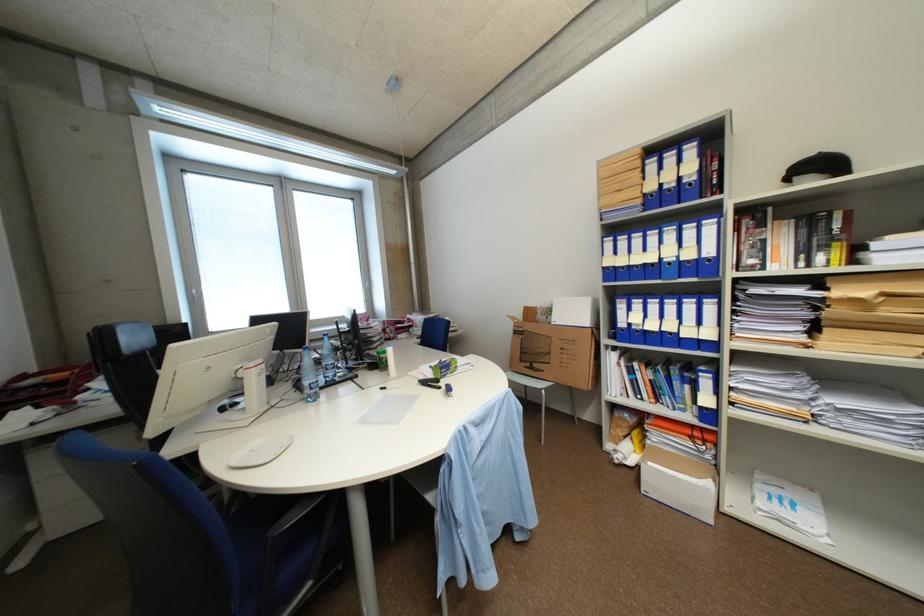
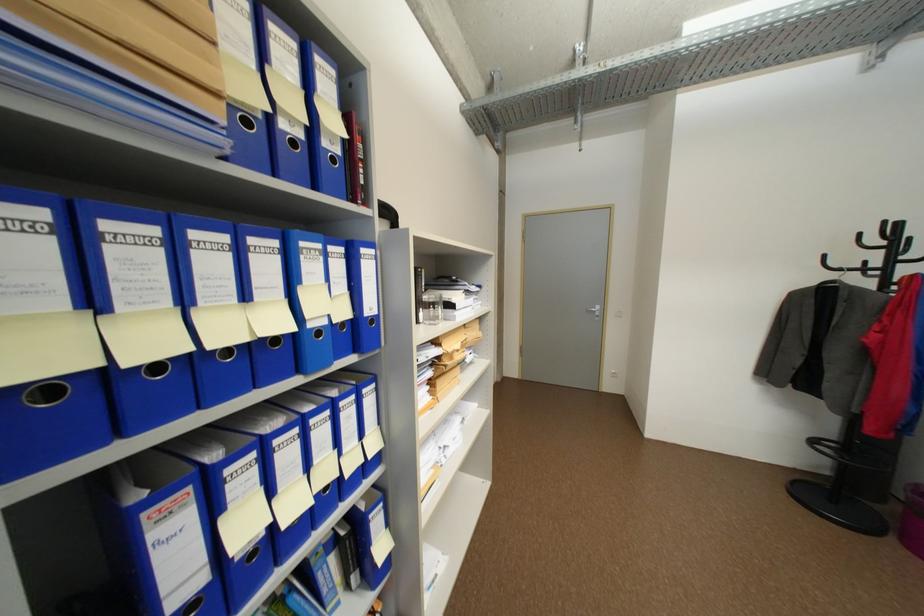
Find the pixel in the second image that matches pixel 630 269 in the first image.

(164, 368)